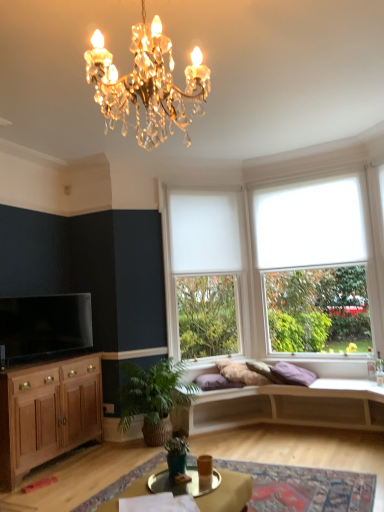
Image resolution: width=384 pixels, height=512 pixels. I want to click on free spot in front of green matte plant at lower center, marked as the first houseplant in a front-to-back arrangement, so click(x=170, y=488).